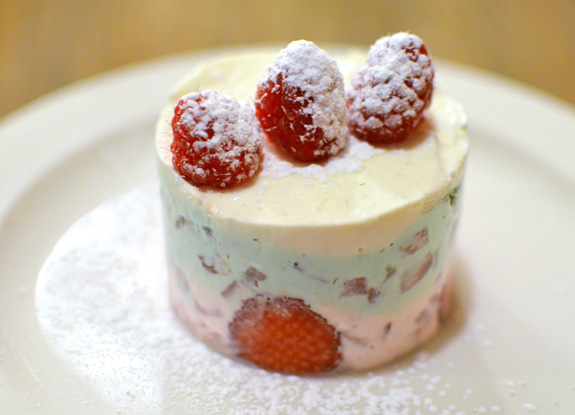
I want to click on outer rim of plate, so click(x=91, y=95).